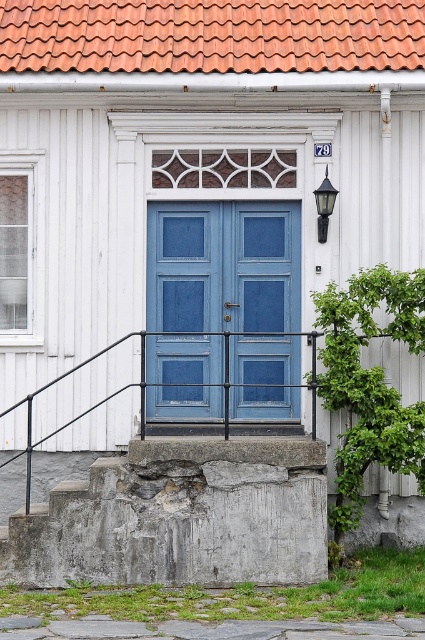
You are a delivery person trying to park your 1.8 meters wide delivery van in front of the house. The gray rough concrete at lower center and the gray concrete at lower center are the only available spaces. Can you fit your van into either of these spaces?

The gray rough concrete at lower center has a width less than the gray concrete at lower center. Since the van is 1.8 meters wide, you need to check both spaces. However, since both spaces are labeled as gray concrete at lower center, it might be a duplication error. Assuming they are separate, the wider one might accommodate the van if its width is at least 1.8 meters, but the description doesn

You are standing in front of the house and notice two points marked on the image. The first point is at coordinates point [399,22] and the second is at point [385,636]. Which point is closer to you?

Point [399,22] is further to the viewer than point [385,636]. Therefore, the second point is closer to you.